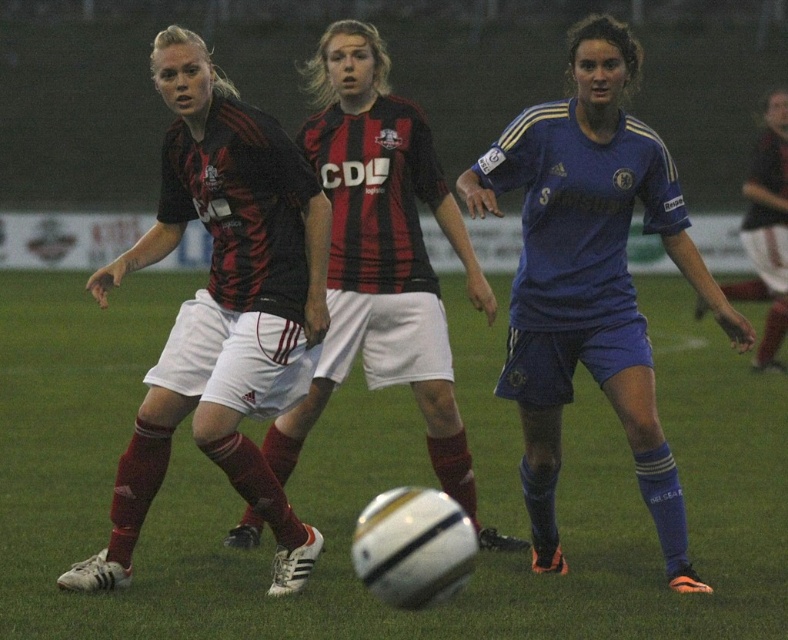
Question: Which object is the farthest from the black matte jersey at left?

Choices:
 (A) black matte soccer ball at center
 (B) blue jersey at center
 (C) white smooth soccer ball at center

Answer: (C)

Question: From the image, what is the correct spatial relationship of white smooth soccer ball at center in relation to black matte jersey at left?

Choices:
 (A) below
 (B) above

Answer: (A)

Question: Does white smooth soccer ball at center have a larger size compared to black matte soccer ball at center?

Choices:
 (A) yes
 (B) no

Answer: (A)

Question: Which point appears closest to the camera in this image?

Choices:
 (A) (322, 336)
 (B) (601, 369)
 (C) (54, 596)
 (D) (396, 195)

Answer: (C)

Question: Can you confirm if black matte jersey at left is positioned to the right of blue jersey at center?

Choices:
 (A) no
 (B) yes

Answer: (A)

Question: Estimate the real-world distances between objects in this image. Which object is closer to the black matte jersey at left?

Choices:
 (A) blue jersey at center
 (B) white smooth soccer ball at center

Answer: (A)